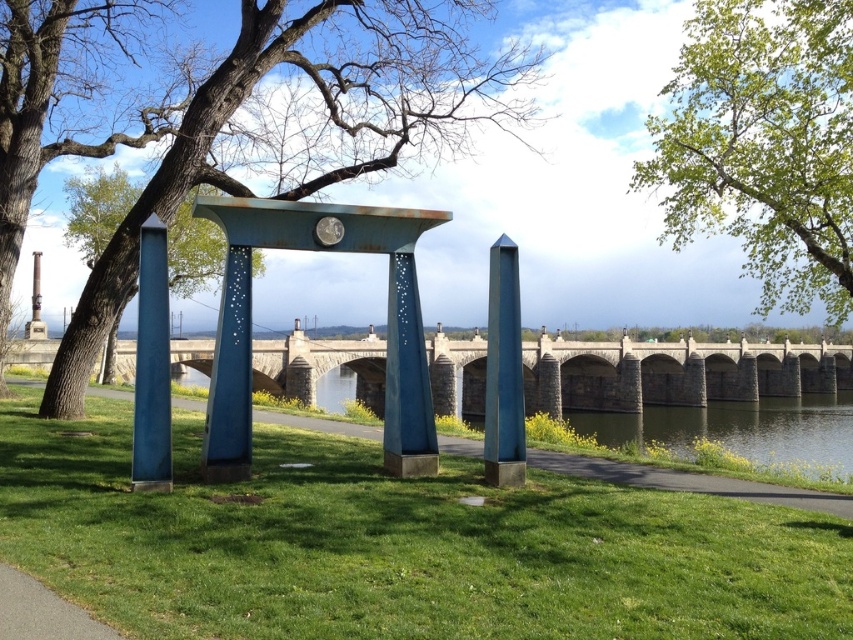
Question: Does rusty blue metal arch at center lie behind gravel path at lower left?

Choices:
 (A) yes
 (B) no

Answer: (A)

Question: Which point is farther to the camera?

Choices:
 (A) green leafy tree at upper center
 (B) brown bark tree at upper left
 (C) blue polished stone obelisk at left
 (D) blue polished stone obelisk at center

Answer: (B)

Question: Is rusty blue metal arch at center closer to the viewer compared to blue polished stone obelisk at left?

Choices:
 (A) yes
 (B) no

Answer: (B)

Question: Estimate the real-world distances between objects in this image. Which object is farther from the gravel path at lower left?

Choices:
 (A) rusty blue metal arch at center
 (B) rusty metal pillar at center

Answer: (B)

Question: Among these objects, which one is farthest from the camera?

Choices:
 (A) blue polished stone obelisk at left
 (B) gravel path at lower left
 (C) blue polished stone obelisk at center
 (D) brown bark tree at upper left

Answer: (D)

Question: In this image, where is rusty blue metal arch at center located relative to rusty metal pillar at center?

Choices:
 (A) below
 (B) above

Answer: (B)